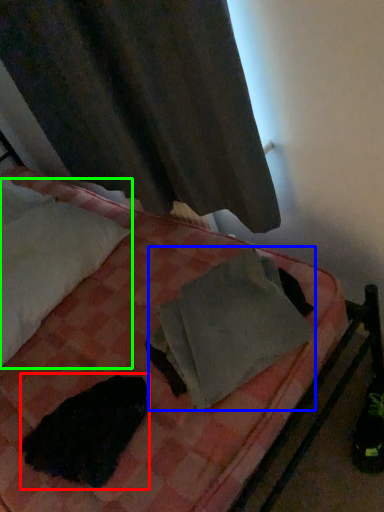
Question: Which object is the farthest from animal (highlighted by a red box)? Choose among these: material (highlighted by a blue box) or pillow (highlighted by a green box).

Choices:
 (A) material
 (B) pillow

Answer: (B)